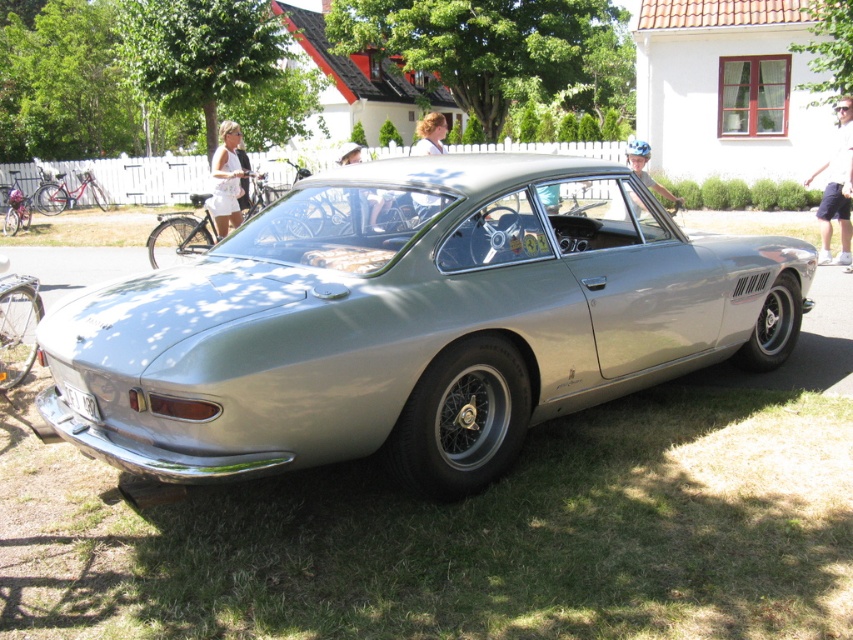
Question: Does satin silver car at center have a smaller size compared to white shorts at right?

Choices:
 (A) no
 (B) yes

Answer: (A)

Question: Among these points, which one is nearest to the camera?

Choices:
 (A) (380, 195)
 (B) (843, 257)

Answer: (A)

Question: Is white shorts at right positioned at the back of white fabric dress at upper center?

Choices:
 (A) no
 (B) yes

Answer: (B)

Question: Which of these objects is positioned closest to the white shorts at right?

Choices:
 (A) light beige fabric shirt at center
 (B) white fabric dress at upper center
 (C) blonde hair at center

Answer: (B)

Question: Which object is closer to the camera taking this photo?

Choices:
 (A) white shorts at right
 (B) satin silver car at center
 (C) blonde hair at center
 (D) light blue helmet at center

Answer: (B)

Question: Does white shorts at right have a larger size compared to light beige fabric shirt at center?

Choices:
 (A) yes
 (B) no

Answer: (B)